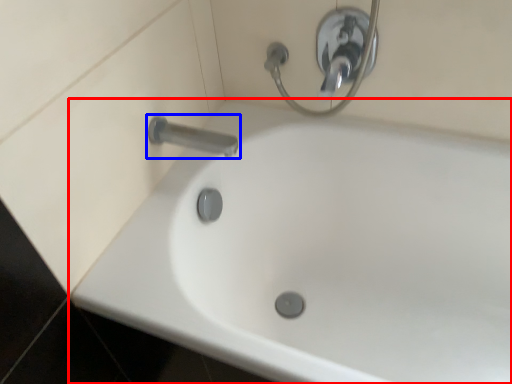
Question: Which of the following is the farthest to the observer, bathtub (highlighted by a red box) or tap (highlighted by a blue box)?

Choices:
 (A) bathtub
 (B) tap

Answer: (B)